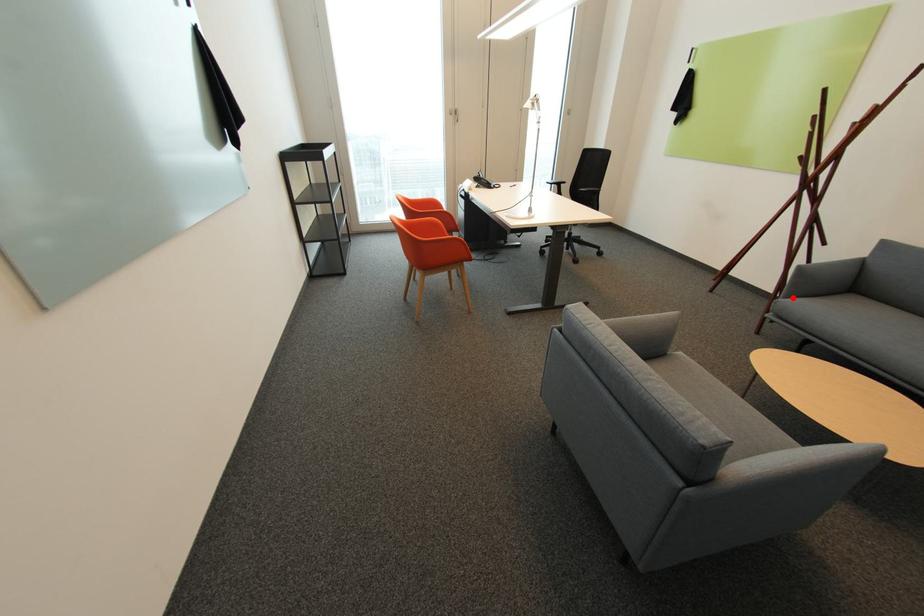
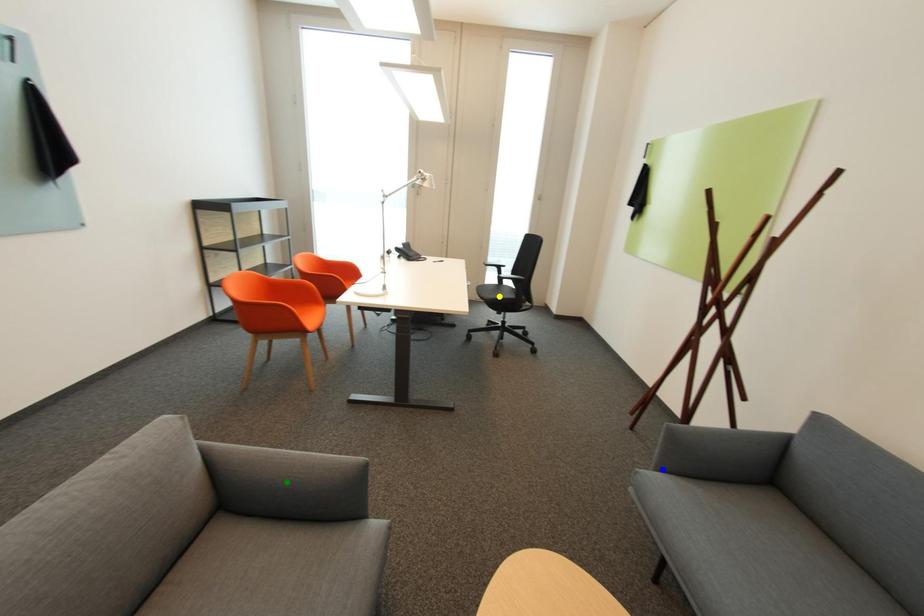
Question: I am providing you with two images of the same scene from different viewpoints. A red point is marked on the first image. You are given multiple points on the second image. Which mark in image 2 goes with the point in image 1?

Choices:
 (A) yellow point
 (B) blue point
 (C) green point

Answer: (B)